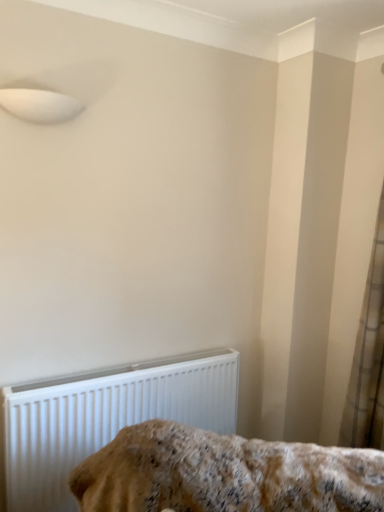
Question: Is white sheer curtain at right taller than fluffy beige blanket at lower center?

Choices:
 (A) yes
 (B) no

Answer: (A)

Question: Is white sheer curtain at right positioned beyond the bounds of fluffy beige blanket at lower center?

Choices:
 (A) yes
 (B) no

Answer: (A)

Question: Is white sheer curtain at right facing away from fluffy beige blanket at lower center?

Choices:
 (A) yes
 (B) no

Answer: (B)

Question: From the image's perspective, is white sheer curtain at right beneath fluffy beige blanket at lower center?

Choices:
 (A) no
 (B) yes

Answer: (A)

Question: From the image's perspective, does white sheer curtain at right appear higher than fluffy beige blanket at lower center?

Choices:
 (A) yes
 (B) no

Answer: (A)

Question: Considering their positions, is fluffy beige blanket at lower center located in front of or behind white sheer curtain at right?

Choices:
 (A) front
 (B) behind

Answer: (A)

Question: In terms of width, does fluffy beige blanket at lower center look wider or thinner when compared to white sheer curtain at right?

Choices:
 (A) wide
 (B) thin

Answer: (A)

Question: Is point (327, 479) closer or farther from the camera than point (365, 431)?

Choices:
 (A) closer
 (B) farther

Answer: (A)

Question: Considering the positions of fluffy beige blanket at lower center and white sheer curtain at right in the image, is fluffy beige blanket at lower center bigger or smaller than white sheer curtain at right?

Choices:
 (A) small
 (B) big

Answer: (B)

Question: Looking at their shapes, would you say white plastic radiator at lower left is wider or thinner than white sheer curtain at right?

Choices:
 (A) wide
 (B) thin

Answer: (B)

Question: Is white plastic radiator at lower left inside the boundaries of white sheer curtain at right, or outside?

Choices:
 (A) outside
 (B) inside

Answer: (A)

Question: Is white plastic radiator at lower left taller or shorter than white sheer curtain at right?

Choices:
 (A) tall
 (B) short

Answer: (B)

Question: Based on their positions, is white plastic radiator at lower left located to the left or right of white sheer curtain at right?

Choices:
 (A) right
 (B) left

Answer: (B)

Question: In the image, is white sheer curtain at right on the left side or the right side of white plastic radiator at lower left?

Choices:
 (A) left
 (B) right

Answer: (B)

Question: Based on their sizes in the image, would you say white sheer curtain at right is bigger or smaller than white plastic radiator at lower left?

Choices:
 (A) small
 (B) big

Answer: (A)